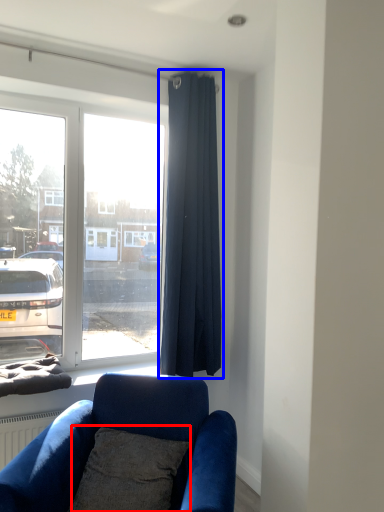
Question: Among these objects, which one is farthest to the camera, pillow (highlighted by a red box) or curtain (highlighted by a blue box)?

Choices:
 (A) pillow
 (B) curtain

Answer: (B)